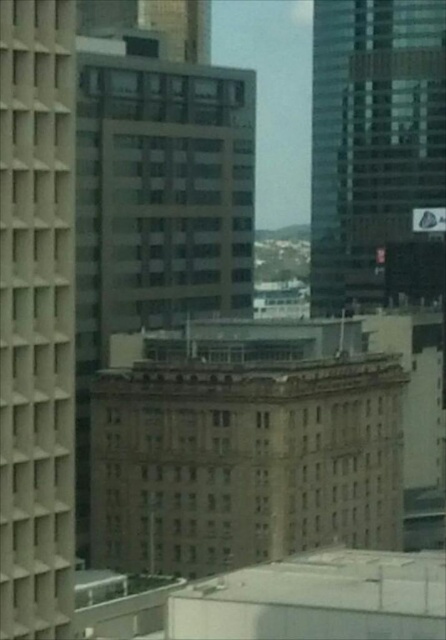
Is the position of brown stone building at center less distant than that of beige concrete building at left?

No, brown stone building at center is behind beige concrete building at left.

Is brown stone building at center further to the viewer compared to beige concrete building at left?

That is True.

Who is more forward, (170, 426) or (21, 198)?

Point (21, 198)

This screenshot has height=640, width=446. What are the coordinates of `brown stone building at center` in the screenshot? It's located at (240, 474).

Does beige concrete building at left have a larger size compared to glassy reflective skyscraper at upper right?

No, beige concrete building at left is not bigger than glassy reflective skyscraper at upper right.

This screenshot has width=446, height=640. What do you see at coordinates (37, 316) in the screenshot?
I see `beige concrete building at left` at bounding box center [37, 316].

The image size is (446, 640). I want to click on beige concrete building at left, so click(x=37, y=316).

Identify the location of beige concrete building at left. Image resolution: width=446 pixels, height=640 pixels. (37, 316).

Is brown stone building at center taller than glassy reflective skyscraper at upper right?

Incorrect, brown stone building at center's height is not larger of glassy reflective skyscraper at upper right's.

This screenshot has width=446, height=640. Describe the element at coordinates (240, 474) in the screenshot. I see `brown stone building at center` at that location.

Which is in front, point (181, 436) or point (389, 93)?

Point (181, 436) is more forward.

Locate an element on the screen. The width and height of the screenshot is (446, 640). brown stone building at center is located at coordinates (240, 474).